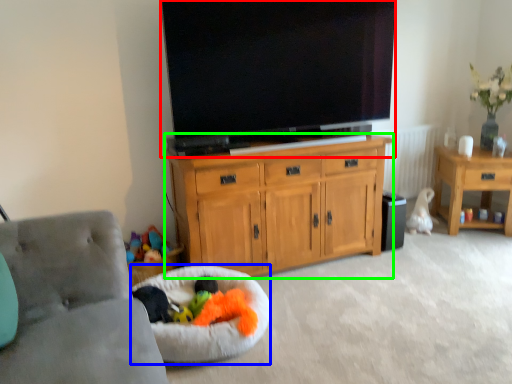
Question: Based on their relative distances, which object is farther from television (highlighted by a red box)? Choose from dog bed (highlighted by a blue box) and cabinetry (highlighted by a green box).

Choices:
 (A) dog bed
 (B) cabinetry

Answer: (A)